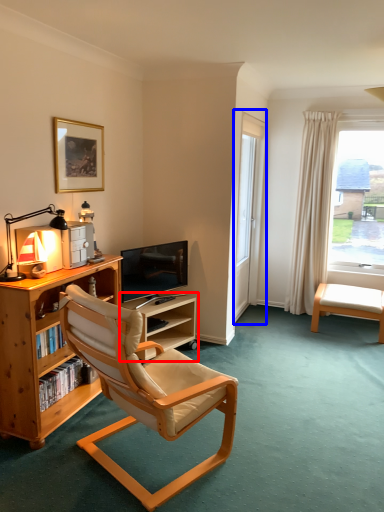
Question: Among these objects, which one is nearest to the camera, shelf (highlighted by a red box) or screen door (highlighted by a blue box)?

Choices:
 (A) shelf
 (B) screen door

Answer: (A)